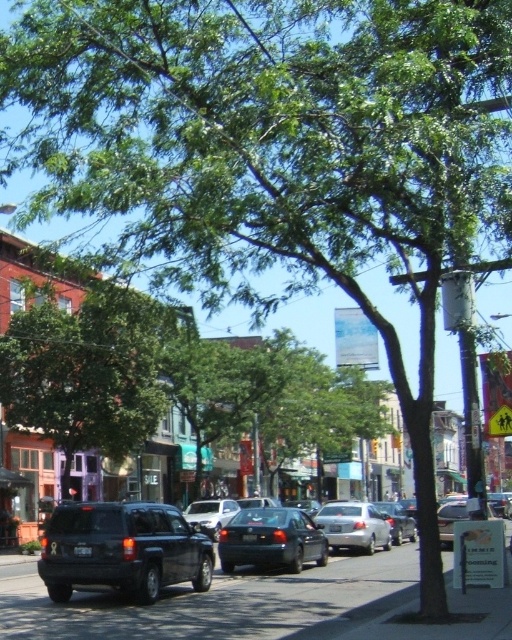
You are a pedestrian standing on the sidewalk. You see a matte black suv at center. Where is the matte black suv at center located relative to the point at coordinates (122, 548)?

The point at coordinates (122, 548) indicates the location of the matte black suv at center.

You are driving a white matte sedan at center and want to park it under the green leafy tree at center. Considering the space available, would the sedan fit comfortably under the tree without touching the branches?

The green leafy tree at center might be wider than the white matte sedan at center, so there is a possibility that the sedan could fit under the tree without touching the branches. However, since the exact width difference isn not specified, it is recommended to check the space carefully before parking.

You are standing on the sidewalk and want to take a photo of both the green leafy tree at center and the white matte sedan at center. Which object should you focus on first to ensure both are in the frame?

To ensure both the green leafy tree at center and the white matte sedan at center are in the frame, focus on the green leafy tree at center first since it is closer to you, allowing you to adjust the camera angle to include the sedan behind it.